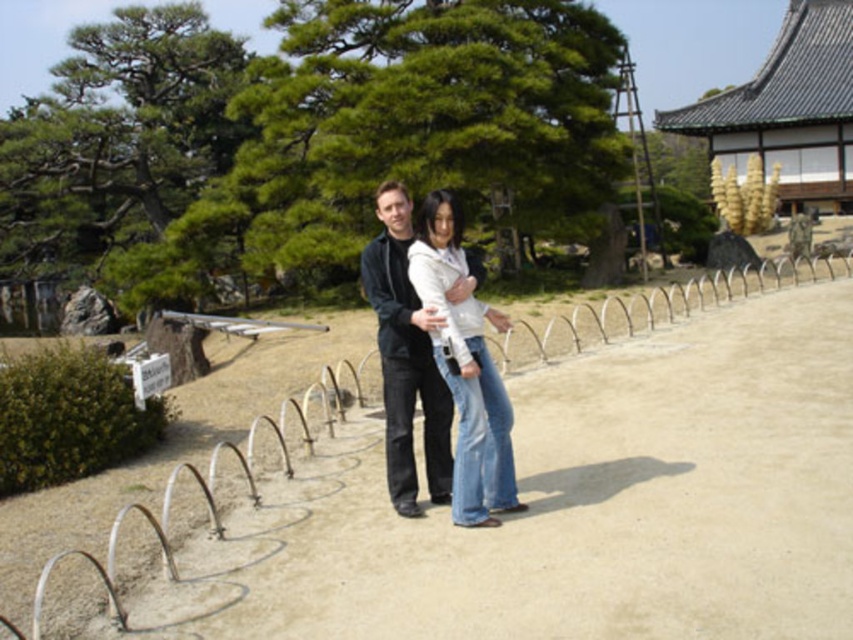
You are a photographer trying to capture a clear shot of the white matte jacket at center without any obstructions. Given that the silver wire fence at center is blocking your view, can you determine if you need to move forward or backward to avoid the fence?

The silver wire fence at center is in front of the white matte jacket at center, so to avoid the fence blocking the jacket, you should move backward to create distance between yourself and the fence, allowing the jacket to be visible behind it.

You are a photographer trying to capture a photo of the dark gray sweater at center without including the silver wire fence at center in the frame. Based on their sizes, is this possible?

The silver wire fence at center might be wider than dark gray sweater at center, so there is a possibility that the silver wire fence at center could block the view of the dark gray sweater at center depending on their exact widths.

You are standing at the origin point of the coordinate system in the image. You want to walk directly to the silver wire fence at center. What direction should you move in?

Since the silver wire fence at center is located at coordinate point (519, 486), you should move northeast to reach it.